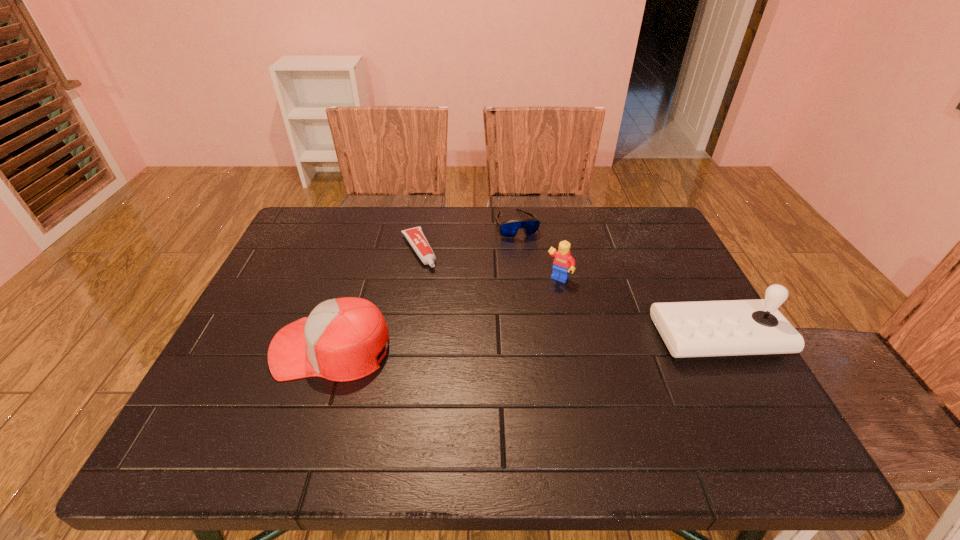
Locate an element on the screen. the fourth closest object to the Lego is located at coordinates (340, 340).

Locate an element on the screen. vacant point that satisfies the following two spatial constraints: 1. on the front side of the sunglasses; 2. on the left side of the joystick is located at coordinates (529, 338).

Where is `free space that satisfies the following two spatial constraints: 1. on the front side of the Lego; 2. on the right side of the toothpaste`? Image resolution: width=960 pixels, height=540 pixels. free space that satisfies the following two spatial constraints: 1. on the front side of the Lego; 2. on the right side of the toothpaste is located at coordinates (414, 279).

At what (x,y) coordinates should I click in order to perform the action: click on vacant region that satisfies the following two spatial constraints: 1. on the front side of the sunglasses; 2. on the left side of the Lego. Please return your answer as a coordinate pair (x, y). Looking at the image, I should click on pos(522,279).